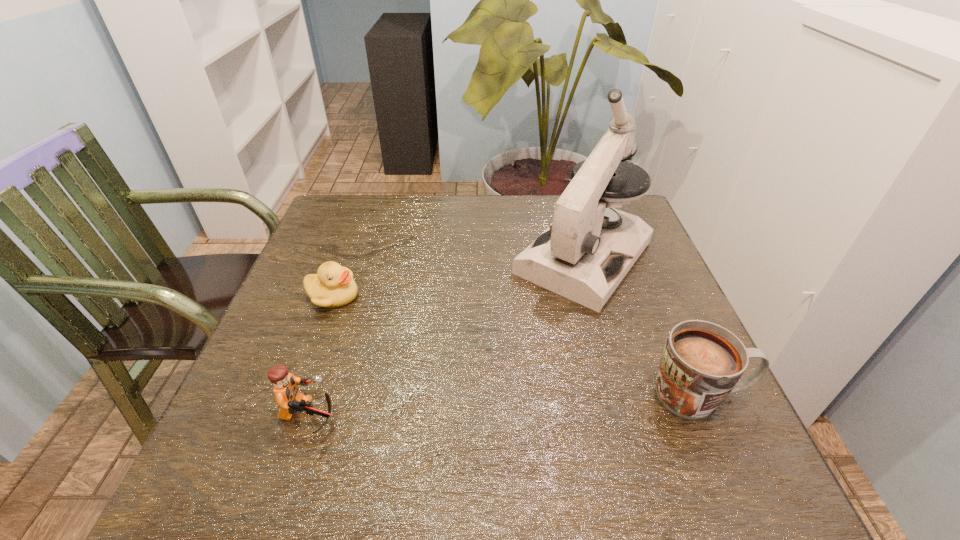
The image size is (960, 540). I want to click on vacant spot on the desktop that is between the Lego and the mug and is positioned at the eyepiece of the microscope, so click(x=452, y=408).

You are a GUI agent. You are given a task and a screenshot of the screen. Output one action in this format:
    pyautogui.click(x=<x>, y=<y>)
    Task: Click on the free space on the desktop that is between the Lego and the mug and is positioned on the front-facing side of the duckling
    
    Given the screenshot: What is the action you would take?
    pyautogui.click(x=453, y=408)